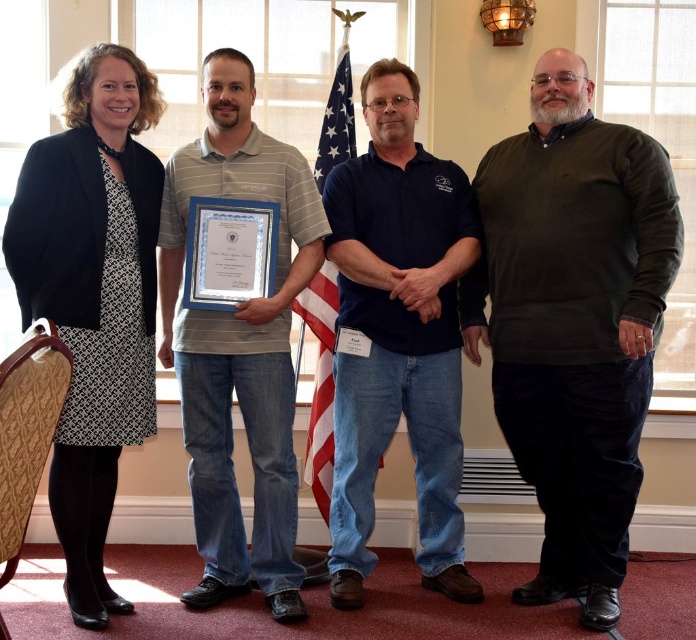
Question: Does olive-green corduroy sweater at right have a lesser width compared to blue cotton shirt at center?

Choices:
 (A) no
 (B) yes

Answer: (A)

Question: Does blue cotton shirt at center come behind american flag at center?

Choices:
 (A) yes
 (B) no

Answer: (B)

Question: Can you confirm if olive-green corduroy sweater at right is positioned above gray striped polo shirt at center?

Choices:
 (A) yes
 (B) no

Answer: (B)

Question: Estimate the real-world distances between objects in this image. Which object is closer to the gray striped polo shirt at center?

Choices:
 (A) olive-green corduroy sweater at right
 (B) american flag at center

Answer: (B)

Question: Which object is the closest to the olive-green corduroy sweater at right?

Choices:
 (A) blue cotton shirt at center
 (B) american flag at center

Answer: (A)

Question: Based on their relative distances, which object is nearer to the gray striped polo shirt at center?

Choices:
 (A) olive-green corduroy sweater at right
 (B) american flag at center

Answer: (B)